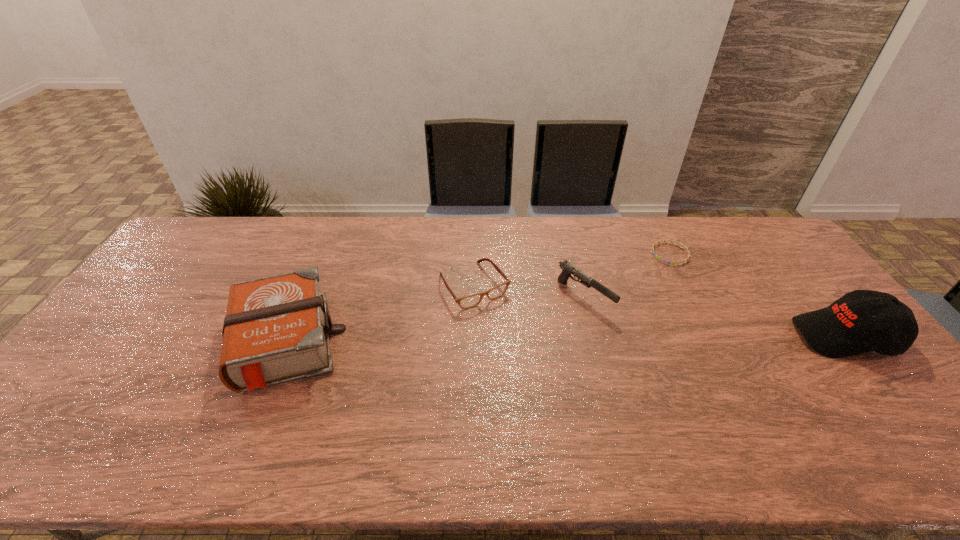
Locate an element on the screen. free location located on the front-facing side of the baseball cap is located at coordinates (759, 336).

In order to click on free space located on the front-facing side of the baseball cap in this screenshot , I will do `click(698, 336)`.

The width and height of the screenshot is (960, 540). Find the location of `vacant point located on the front-facing side of the fourth tallest object`. vacant point located on the front-facing side of the fourth tallest object is located at coordinates [511, 337].

Where is `free region located 0.110m on the front-facing side of the fourth tallest object`? free region located 0.110m on the front-facing side of the fourth tallest object is located at coordinates (509, 335).

Identify the location of free space located on the front-facing side of the fourth tallest object. This screenshot has height=540, width=960. (561, 405).

Locate an element on the screen. This screenshot has width=960, height=540. vacant space located at the muzzle end of the third tallest object is located at coordinates (671, 361).

This screenshot has width=960, height=540. Find the location of `free space located 0.270m at the muzzle end of the third tallest object`. free space located 0.270m at the muzzle end of the third tallest object is located at coordinates (687, 374).

You are a GUI agent. You are given a task and a screenshot of the screen. Output one action in this format:
    pyautogui.click(x=<x>, y=<y>)
    Task: Click on the vacant space situated at the muzzle end of the third tallest object
    
    Given the screenshot: What is the action you would take?
    pyautogui.click(x=618, y=324)

Find the location of `vacant space located 0.280m on the surface of the bracelet showing star-shaped elements`. vacant space located 0.280m on the surface of the bracelet showing star-shaped elements is located at coordinates (609, 301).

Find the location of `free region located 0.250m on the surface of the bracelet showing star-shaped elements`. free region located 0.250m on the surface of the bracelet showing star-shaped elements is located at coordinates (614, 296).